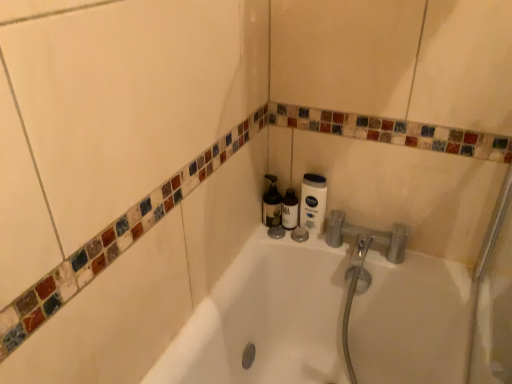
What are the coordinates of `white matte lotion at upper right` in the screenshot? It's located at [313, 203].

What do you see at coordinates (271, 204) in the screenshot? I see `translucent plastic bottle at center` at bounding box center [271, 204].

What is the approximate width of matte black bottle at center?

5.68 centimeters.

Find the location of a particular element. white matte lotion at upper right is located at coordinates (313, 203).

Is translucent plastic bottle at center in front of or behind white matte lotion at upper right in the image?

In the image, translucent plastic bottle at center appears behind white matte lotion at upper right.

Considering the positions of points (275, 206) and (319, 197), is point (275, 206) farther from camera compared to point (319, 197)?

Yes, it is behind point (319, 197).

Which of these two, translucent plastic bottle at center or white matte lotion at upper right, is wider?

Wider between the two is translucent plastic bottle at center.

From the image's perspective, is translucent plastic bottle at center located above or below white matte lotion at upper right?

From the image's perspective, translucent plastic bottle at center appears above white matte lotion at upper right.

Considering the sizes of translucent plastic bottle at center and matte black bottle at center in the image, is translucent plastic bottle at center wider or thinner than matte black bottle at center?

Considering their sizes, translucent plastic bottle at center looks broader than matte black bottle at center.

Considering the positions of objects translucent plastic bottle at center and matte black bottle at center in the image provided, who is behind, translucent plastic bottle at center or matte black bottle at center?

matte black bottle at center.

Is translucent plastic bottle at center looking in the opposite direction of matte black bottle at center?

translucent plastic bottle at center is not turned away from matte black bottle at center.

Is translucent plastic bottle at center taller or shorter than matte black bottle at center?

translucent plastic bottle at center is taller than matte black bottle at center.

Is white matte lotion at upper right not close to translucent plastic bottle at center?

No, white matte lotion at upper right is in close proximity to translucent plastic bottle at center.

In the image, there is a translucent plastic bottle at center. Identify the location of cleaning product below it (from the image's perspective). (313, 203).

Considering the points (321, 194) and (271, 206), which point is in front, point (321, 194) or point (271, 206)?

Positioned in front is point (321, 194).

Who is shorter, white matte lotion at upper right or translucent plastic bottle at center?

translucent plastic bottle at center.

Considering the relative sizes of matte black bottle at center and white matte lotion at upper right in the image provided, is matte black bottle at center taller than white matte lotion at upper right?

No.

Is matte black bottle at center at the left side of white matte lotion at upper right?

Correct, you'll find matte black bottle at center to the left of white matte lotion at upper right.

How different are the orientations of matte black bottle at center and white matte lotion at upper right in degrees?

They differ by 0.00166 degrees in their facing directions.

From the image's perspective, between matte black bottle at center and white matte lotion at upper right, who is located below?

From the image's view, matte black bottle at center is below.

Does matte black bottle at center have a lesser height compared to translucent plastic bottle at center?

Correct, matte black bottle at center is not as tall as translucent plastic bottle at center.

From the image's perspective, between matte black bottle at center and translucent plastic bottle at center, which one is located above?

translucent plastic bottle at center.

Is matte black bottle at center oriented away from translucent plastic bottle at center?

matte black bottle at center does not have its back to translucent plastic bottle at center.

What's the angular difference between matte black bottle at center and translucent plastic bottle at center's facing directions?

The facing directions of matte black bottle at center and translucent plastic bottle at center are 0.00408 degrees apart.

From the picture: Is white matte lotion at upper right facing towards matte black bottle at center?

No, white matte lotion at upper right is not turned towards matte black bottle at center.

In the scene shown: From a real-world perspective, which object stands above the other?

From a 3D spatial view, white matte lotion at upper right is above.

From the image's perspective, which object appears higher, white matte lotion at upper right or matte black bottle at center?

white matte lotion at upper right.

Is white matte lotion at upper right in contact with matte black bottle at center?

Yes, white matte lotion at upper right is in contact with matte black bottle at center.

Locate an element on the screen. The height and width of the screenshot is (384, 512). bottle below the white matte lotion at upper right (from a real-world perspective) is located at coordinates (271, 204).

Identify the location of toiletry on the right of the translucent plastic bottle at center. This screenshot has width=512, height=384. [290, 210].

Based on their spatial positions, is translucent plastic bottle at center or matte black bottle at center further from white matte lotion at upper right?

translucent plastic bottle at center is positioned further to the anchor white matte lotion at upper right.

Considering their positions, is matte black bottle at center positioned closer to translucent plastic bottle at center than white matte lotion at upper right?

Based on the image, matte black bottle at center appears to be nearer to translucent plastic bottle at center.

Looking at the image, which one is located further to matte black bottle at center, translucent plastic bottle at center or white matte lotion at upper right?

white matte lotion at upper right is positioned further to the anchor matte black bottle at center.

Considering their positions, is white matte lotion at upper right positioned closer to matte black bottle at center than translucent plastic bottle at center?

Based on the image, translucent plastic bottle at center appears to be nearer to matte black bottle at center.

Estimate the real-world distances between objects in this image. Which object is further from translucent plastic bottle at center, white matte lotion at upper right or matte black bottle at center?

white matte lotion at upper right.

Which object lies nearer to the anchor point white matte lotion at upper right, matte black bottle at center or translucent plastic bottle at center?

Based on the image, matte black bottle at center appears to be nearer to white matte lotion at upper right.

Where is `toiletry between translucent plastic bottle at center and white matte lotion at upper right in the horizontal direction`? The image size is (512, 384). toiletry between translucent plastic bottle at center and white matte lotion at upper right in the horizontal direction is located at coordinates (290, 210).